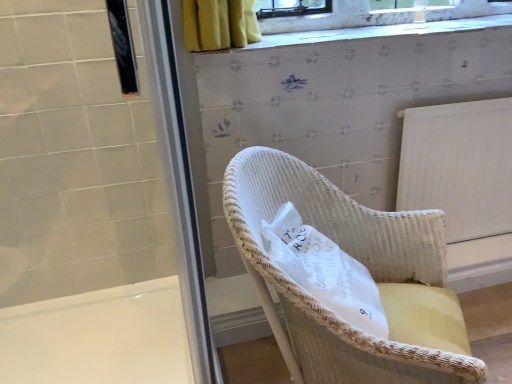
Locate an element on the screen. white glossy bath at lower left is located at coordinates (98, 337).

In order to face transparent plastic screen door at left, which is counted as the second screen door, starting from the left, should I rotate leftwards or rightwards?

To align with it, rotate left about 10.292°.

The image size is (512, 384). I want to click on transparent plastic screen door at left, which is counted as the second screen door, starting from the left, so click(178, 182).

Find the location of `white glossy screen door at upper left, which appears as the 1th screen door when viewed from the left`. white glossy screen door at upper left, which appears as the 1th screen door when viewed from the left is located at coordinates (92, 206).

You are a GUI agent. You are given a task and a screenshot of the screen. Output one action in this format:
    pyautogui.click(x=<x>, y=<y>)
    Task: Click on the white glossy bath at lower left
    The image size is (512, 384).
    Given the screenshot: What is the action you would take?
    pyautogui.click(x=98, y=337)

From the image's perspective, is white glossy screen door at upper left, which appears as the 1th screen door when viewed from the left, on white glossy bath at lower left?

Correct, white glossy screen door at upper left, which appears as the 1th screen door when viewed from the left, appears higher than white glossy bath at lower left in the image.

Would you say white glossy screen door at upper left, which appears as the 1th screen door when viewed from the left, is outside white glossy bath at lower left?

Indeed, white glossy screen door at upper left, which appears as the 1th screen door when viewed from the left, is completely outside white glossy bath at lower left.

From a real-world perspective, is white glossy screen door at upper left, which appears as the 1th screen door when viewed from the left, on white glossy bath at lower left?

Correct, in the physical world, white glossy screen door at upper left, which appears as the 1th screen door when viewed from the left, is higher than white glossy bath at lower left.

From the picture: Is white glossy bath at lower left far away from white wicker chair at center?

No, white glossy bath at lower left is not far away from white wicker chair at center.

Looking at their sizes, would you say white glossy bath at lower left is wider or thinner than white wicker chair at center?

Clearly, white glossy bath at lower left has more width compared to white wicker chair at center.

From the image's perspective, is white glossy bath at lower left located beneath white wicker chair at center?

Yes, from the image's perspective, white glossy bath at lower left is below white wicker chair at center.

Based on the photo, which point is more forward, (10, 377) or (314, 275)?

The point (314, 275) is closer to the camera.

Does woven white chair at center have a larger size compared to transparent plastic screen door at left, which is counted as the second screen door, starting from the left?

Indeed, woven white chair at center has a larger size compared to transparent plastic screen door at left, which is counted as the second screen door, starting from the left.

Does woven white chair at center have a greater width compared to transparent plastic screen door at left, placed as the first screen door when sorted from right to left?

Yes.

Based on the photo, is woven white chair at center further to camera compared to transparent plastic screen door at left, which is counted as the second screen door, starting from the left?

That is True.

From the image's perspective, is white wicker chair at center beneath woven white chair at center?

Actually, white wicker chair at center appears above woven white chair at center in the image.

From a real-world perspective, which object rests below the other?

woven white chair at center is physically lower.

Does white wicker chair at center have a larger size compared to woven white chair at center?

No.

Looking at their sizes, would you say white wicker chair at center is wider or thinner than woven white chair at center?

Clearly, white wicker chair at center has less width compared to woven white chair at center.

Can you confirm if white wicker chair at center is smaller than white glossy screen door at upper left, the 2th screen door in the right-to-left sequence?

Incorrect, white wicker chair at center is not smaller in size than white glossy screen door at upper left, the 2th screen door in the right-to-left sequence.

Considering the sizes of objects white wicker chair at center and white glossy screen door at upper left, the 2th screen door in the right-to-left sequence, in the image provided, who is wider, white wicker chair at center or white glossy screen door at upper left, the 2th screen door in the right-to-left sequence,?

white wicker chair at center.

Which of these two, white wicker chair at center or white glossy screen door at upper left, the 2th screen door in the right-to-left sequence, stands shorter?

white wicker chair at center.

Is white wicker chair at center not near white glossy screen door at upper left, which appears as the 1th screen door when viewed from the left?

That's not correct — white wicker chair at center is a little close to white glossy screen door at upper left, which appears as the 1th screen door when viewed from the left.

From the image's perspective, between transparent plastic screen door at left, which is counted as the second screen door, starting from the left, and woven white chair at center, which one is located above?

transparent plastic screen door at left, which is counted as the second screen door, starting from the left, from the image's perspective.

Are transparent plastic screen door at left, which is counted as the second screen door, starting from the left, and woven white chair at center located far from each other?

No.

From a real-world perspective, is transparent plastic screen door at left, placed as the first screen door when sorted from right to left, above or below woven white chair at center?

transparent plastic screen door at left, placed as the first screen door when sorted from right to left, is situated higher than woven white chair at center in the real world.

Is point (170, 128) positioned after point (238, 203)?

No, (170, 128) is closer to viewer.

Find the location of a particular element. The height and width of the screenshot is (384, 512). the 2nd screen door above the woven white chair at center (from the image's perspective) is located at coordinates (92, 206).

Which of these two, white glossy screen door at upper left, which appears as the 1th screen door when viewed from the left, or woven white chair at center, is smaller?

With smaller size is white glossy screen door at upper left, which appears as the 1th screen door when viewed from the left.

Is white glossy screen door at upper left, the 2th screen door in the right-to-left sequence, taller or shorter than woven white chair at center?

Considering their sizes, white glossy screen door at upper left, the 2th screen door in the right-to-left sequence, has more height than woven white chair at center.

From the image's perspective, starting from the white glossy bath at lower left, which screen door is the 2nd one above? Please provide its 2D coordinates.

[(92, 206)]

Where is `bath below the white wicker chair at center (from a real-world perspective)`? The width and height of the screenshot is (512, 384). bath below the white wicker chair at center (from a real-world perspective) is located at coordinates (98, 337).

Based on their spatial positions, is white glossy bath at lower left or woven white chair at center closer to white glossy screen door at upper left, the 2th screen door in the right-to-left sequence?

Among the two, white glossy bath at lower left is located nearer to white glossy screen door at upper left, the 2th screen door in the right-to-left sequence.

Based on their spatial positions, is white wicker chair at center or transparent plastic screen door at left, which is counted as the second screen door, starting from the left, further from white glossy bath at lower left?

Based on the image, transparent plastic screen door at left, which is counted as the second screen door, starting from the left, appears to be further to white glossy bath at lower left.

Considering their positions, is white wicker chair at center positioned closer to white glossy screen door at upper left, the 2th screen door in the right-to-left sequence, than white glossy bath at lower left?

Among the two, white glossy bath at lower left is located nearer to white glossy screen door at upper left, the 2th screen door in the right-to-left sequence.

Considering their positions, is transparent plastic screen door at left, placed as the first screen door when sorted from right to left, positioned further to white glossy screen door at upper left, the 2th screen door in the right-to-left sequence, than woven white chair at center?

Among the two, transparent plastic screen door at left, placed as the first screen door when sorted from right to left, is located further to white glossy screen door at upper left, the 2th screen door in the right-to-left sequence.

Considering their positions, is white glossy bath at lower left positioned further to transparent plastic screen door at left, placed as the first screen door when sorted from right to left, than woven white chair at center?

white glossy bath at lower left lies further to transparent plastic screen door at left, placed as the first screen door when sorted from right to left, than the other object.

Considering their positions, is white wicker chair at center positioned closer to transparent plastic screen door at left, which is counted as the second screen door, starting from the left, than woven white chair at center?

Among the two, white wicker chair at center is located nearer to transparent plastic screen door at left, which is counted as the second screen door, starting from the left.

When comparing their distances from white glossy screen door at upper left, which appears as the 1th screen door when viewed from the left, does transparent plastic screen door at left, placed as the first screen door when sorted from right to left, or white wicker chair at center seem closer?

white wicker chair at center is positioned closer to the anchor white glossy screen door at upper left, which appears as the 1th screen door when viewed from the left.

From the image, which object appears to be farther from white glossy bath at lower left, transparent plastic screen door at left, placed as the first screen door when sorted from right to left, or white glossy screen door at upper left, which appears as the 1th screen door when viewed from the left?

The object further to white glossy bath at lower left is transparent plastic screen door at left, placed as the first screen door when sorted from right to left.

Locate an element on the screen. The image size is (512, 384). material between transparent plastic screen door at left, placed as the first screen door when sorted from right to left, and woven white chair at center from left to right is located at coordinates click(325, 271).

You are a GUI agent. You are given a task and a screenshot of the screen. Output one action in this format:
    pyautogui.click(x=<x>, y=<y>)
    Task: Click on the screen door situated between white glossy screen door at upper left, which appears as the 1th screen door when viewed from the left, and woven white chair at center from left to right
    Image resolution: width=512 pixels, height=384 pixels.
    Given the screenshot: What is the action you would take?
    pyautogui.click(x=178, y=182)

Find the location of a particular element. The height and width of the screenshot is (384, 512). screen door between white glossy bath at lower left and woven white chair at center from left to right is located at coordinates (178, 182).

You are a GUI agent. You are given a task and a screenshot of the screen. Output one action in this format:
    pyautogui.click(x=<x>, y=<y>)
    Task: Click on the screen door between white glossy screen door at upper left, the 2th screen door in the right-to-left sequence, and white wicker chair at center
    The width and height of the screenshot is (512, 384).
    Given the screenshot: What is the action you would take?
    pyautogui.click(x=178, y=182)